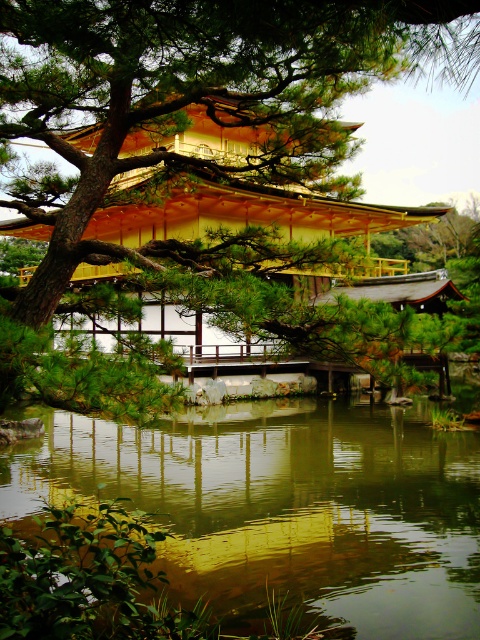
Does green textured pine tree at upper left come in front of green reflective water at center?

Yes, green textured pine tree at upper left is closer to the viewer.

Based on the photo, can you confirm if green textured pine tree at upper left is thinner than green reflective water at center?

Correct, green textured pine tree at upper left's width is less than green reflective water at center's.

Image resolution: width=480 pixels, height=640 pixels. In order to click on green textured pine tree at upper left in this screenshot , I will do `click(195, 108)`.

The width and height of the screenshot is (480, 640). Identify the location of green textured pine tree at upper left. (195, 108).